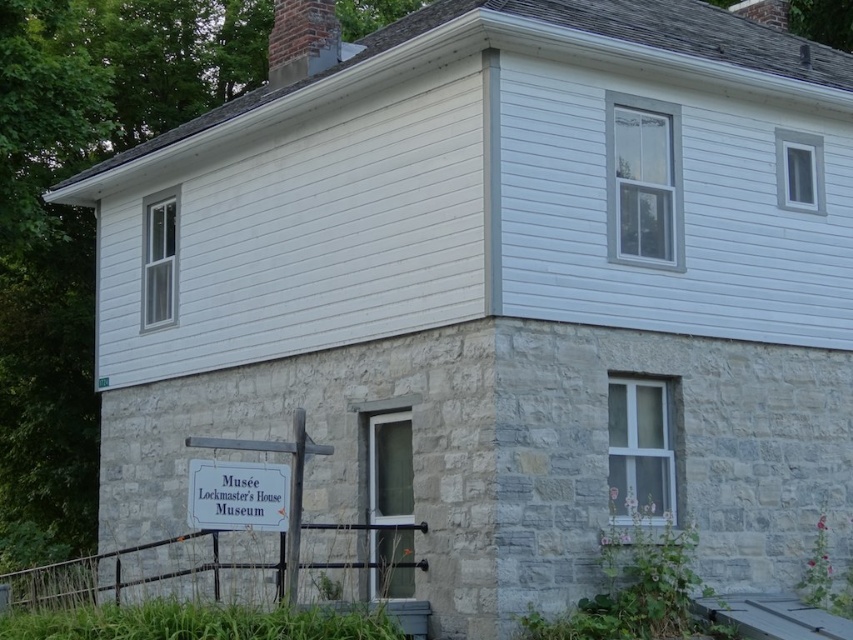
You are standing in front of the building and want to read the white wooden sign at lower center. Is the gray stone chimney at upper center blocking your view of the sign?

The white wooden sign at lower center is closer to the viewer than the gray stone chimney at upper center, so the chimney is behind the sign and does not block the view.